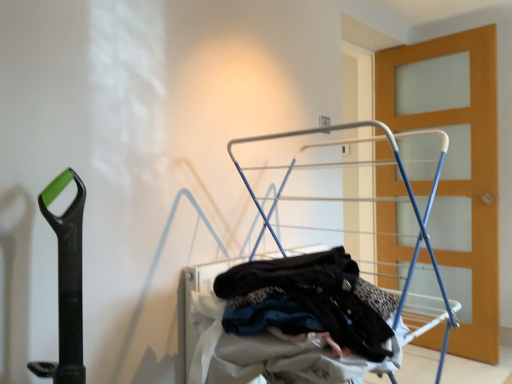
What do you see at coordinates (456, 166) in the screenshot? This screenshot has width=512, height=384. I see `wooden door at right` at bounding box center [456, 166].

This screenshot has height=384, width=512. In order to click on wooden door at right in this screenshot , I will do `click(456, 166)`.

What do you see at coordinates (303, 313) in the screenshot? I see `white metallic drying rack at center` at bounding box center [303, 313].

The width and height of the screenshot is (512, 384). In order to click on white metallic drying rack at center in this screenshot , I will do `click(303, 313)`.

At what (x,y) coordinates should I click in order to perform the action: click on wooden door at right. Please return your answer as a coordinate pair (x, y). This screenshot has height=384, width=512. Looking at the image, I should click on (456, 166).

Would you say wooden door at right is to the left or to the right of white metallic drying rack at center in the picture?

In the image, wooden door at right appears on the right side of white metallic drying rack at center.

Relative to white metallic drying rack at center, is wooden door at right in front or behind?

In the image, wooden door at right appears behind white metallic drying rack at center.

Is point (479, 349) positioned after point (286, 255)?

Yes.

Based on the photo, from the image's perspective, is wooden door at right beneath white metallic drying rack at center?

Actually, wooden door at right appears above white metallic drying rack at center in the image.

From a real-world perspective, is wooden door at right under white metallic drying rack at center?

Actually, wooden door at right is physically above white metallic drying rack at center in the real world.

Considering the relative sizes of wooden door at right and white metallic drying rack at center in the image provided, is wooden door at right thinner than white metallic drying rack at center?

Yes, wooden door at right is thinner than white metallic drying rack at center.

Who is taller, wooden door at right or white metallic drying rack at center?

Standing taller between the two is wooden door at right.

Looking at the image, does wooden door at right seem bigger or smaller compared to white metallic drying rack at center?

wooden door at right is smaller than white metallic drying rack at center.

Does wooden door at right contain white metallic drying rack at center?

No, white metallic drying rack at center is located outside of wooden door at right.

Is wooden door at right positioned far away from white metallic drying rack at center?

wooden door at right is positioned a significant distance from white metallic drying rack at center.

Could you tell me if wooden door at right is facing white metallic drying rack at center?

Yes.

How different are the orientations of wooden door at right and white metallic drying rack at center in degrees?

The angle between the facing direction of wooden door at right and the facing direction of white metallic drying rack at center is 90.1 degrees.

Locate an element on the screen. This screenshot has width=512, height=384. baby carriage on the left of wooden door at right is located at coordinates (303, 313).

Between white metallic drying rack at center and wooden door at right, which one appears on the left side from the viewer's perspective?

white metallic drying rack at center.

Is white metallic drying rack at center further to the viewer compared to wooden door at right?

No, white metallic drying rack at center is in front of wooden door at right.

Which is closer to the camera, (361, 324) or (483, 99)?

Clearly, point (361, 324) is closer to the camera than point (483, 99).

From the image's perspective, which one is positioned higher, white metallic drying rack at center or wooden door at right?

wooden door at right, from the image's perspective.

From a real-world perspective, is white metallic drying rack at center positioned above or below wooden door at right?

From a real-world perspective, white metallic drying rack at center is physically below wooden door at right.

Does white metallic drying rack at center have a greater width compared to wooden door at right?

Indeed, white metallic drying rack at center has a greater width compared to wooden door at right.

Is white metallic drying rack at center taller or shorter than wooden door at right?

Considering their sizes, white metallic drying rack at center has less height than wooden door at right.

Which of these two, white metallic drying rack at center or wooden door at right, is smaller?

With smaller size is wooden door at right.

Is white metallic drying rack at center not within wooden door at right?

That's correct, white metallic drying rack at center is outside of wooden door at right.

Is white metallic drying rack at center next to wooden door at right and touching it?

No.

Is white metallic drying rack at center oriented towards wooden door at right?

No.

How different are the orientations of white metallic drying rack at center and wooden door at right in degrees?

90.1 degrees separate the facing orientations of white metallic drying rack at center and wooden door at right.

Locate an element on the screen. door above the white metallic drying rack at center (from the image's perspective) is located at coordinates (456, 166).

What are the coordinates of `baby carriage on the left of wooden door at right` in the screenshot? It's located at 303,313.

I want to click on baby carriage below the wooden door at right (from a real-world perspective), so click(x=303, y=313).